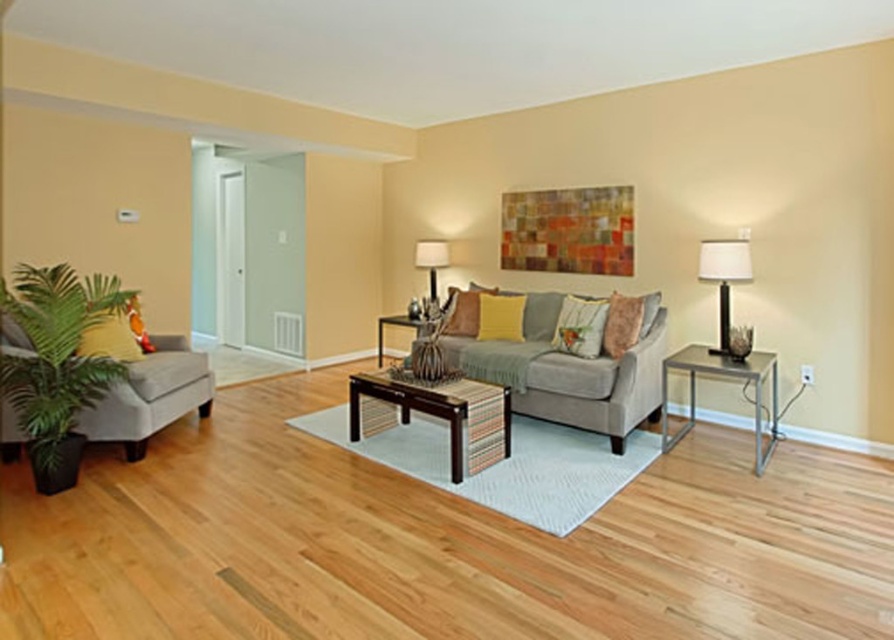
You are a guest entering the living room and want to place a small decorative item on the wooden coffee table at center. However, you notice the green leafy plant at left. Where should you place the item to ensure it is on the coffee table and not on the plant?

The green leafy plant at left is below the wooden coffee table at center, so you should place the item on top of the wooden coffee table at center to ensure it is not on the plant.

You are standing in the living room and want to place a small plant between the two points, point (10, 300) and point (377, 342). Which point should you place the plant closer to if you want it to be nearer to the sofa?

You should place the plant closer to point (10, 300) because it is closer to the viewer, meaning it is positioned nearer to the sofa compared to point (377, 342).

You are arranging a party in the living room and need to place a large centerpiece on the coffee tables. Which coffee table should you choose between the dark brown wood coffee table at center and the wooden coffee table at center to ensure the centerpiece fits properly?

The dark brown wood coffee table at center is located below the wooden coffee table at center, meaning it is the lower one. Since centerpieces are typically placed on the main surface, you should choose the wooden coffee table at center as it is the upper table and more accessible for placing the centerpiece.